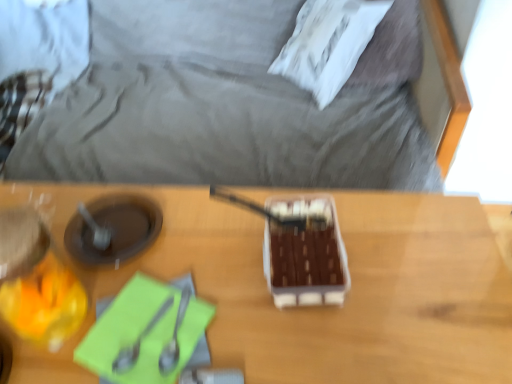
Question: Does satin silver spoon at lower left, placed as the 1th utensil when sorted from left to right, have a greater width compared to wooden table at center?

Choices:
 (A) no
 (B) yes

Answer: (A)

Question: From the image's perspective, is satin silver spoon at lower left, which is the second utensil in right-to-left order, below wooden table at center?

Choices:
 (A) yes
 (B) no

Answer: (B)

Question: Considering the relative sizes of satin silver spoon at lower left, placed as the 1th utensil when sorted from left to right, and wooden table at center in the image provided, is satin silver spoon at lower left, placed as the 1th utensil when sorted from left to right, bigger than wooden table at center?

Choices:
 (A) no
 (B) yes

Answer: (A)

Question: From a real-world perspective, is satin silver spoon at lower left, which is the second utensil in right-to-left order, beneath wooden table at center?

Choices:
 (A) yes
 (B) no

Answer: (B)

Question: From a real-world perspective, is satin silver spoon at lower left, which is the second utensil in right-to-left order, over wooden table at center?

Choices:
 (A) yes
 (B) no

Answer: (A)

Question: Is satin silver spoon at lower left, placed as the 1th utensil when sorted from left to right, not near wooden table at center?

Choices:
 (A) no
 (B) yes

Answer: (A)

Question: Is wooden table at center oriented away from satin silver spoon at center, marked as the 1th utensil in a right-to-left arrangement?

Choices:
 (A) no
 (B) yes

Answer: (A)

Question: Can you confirm if wooden table at center is taller than satin silver spoon at center, marked as the 1th utensil in a right-to-left arrangement?

Choices:
 (A) no
 (B) yes

Answer: (B)

Question: Is wooden table at center oriented towards satin silver spoon at center, the second utensil positioned from the left?

Choices:
 (A) yes
 (B) no

Answer: (B)

Question: Does wooden table at center lie in front of satin silver spoon at center, the second utensil positioned from the left?

Choices:
 (A) yes
 (B) no

Answer: (A)

Question: From a real-world perspective, is wooden table at center under satin silver spoon at center, the second utensil positioned from the left?

Choices:
 (A) no
 (B) yes

Answer: (B)

Question: Is wooden table at center not close to satin silver spoon at center, marked as the 1th utensil in a right-to-left arrangement?

Choices:
 (A) yes
 (B) no

Answer: (B)

Question: Considering the relative sizes of white soft pillow at upper center and wooden table at center in the image provided, is white soft pillow at upper center wider than wooden table at center?

Choices:
 (A) yes
 (B) no

Answer: (B)